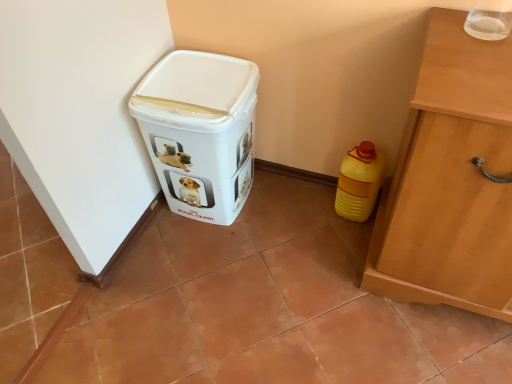
Identify the location of free space in front of white plastic container at lower left. (209, 268).